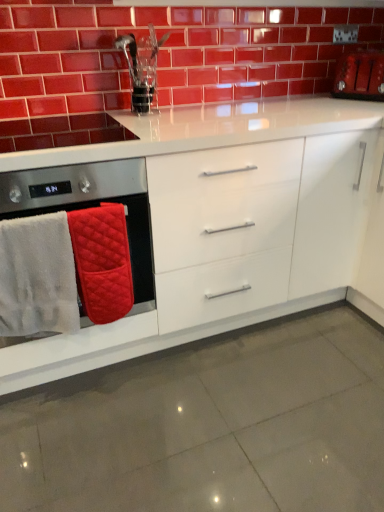
Question: Is quilted fabric oven mitts at left smaller than white glossy cabinet at center?

Choices:
 (A) no
 (B) yes

Answer: (B)

Question: Can you confirm if quilted fabric oven mitts at left is wider than white glossy cabinet at center?

Choices:
 (A) no
 (B) yes

Answer: (A)

Question: From the image's perspective, is quilted fabric oven mitts at left below white glossy cabinet at center?

Choices:
 (A) yes
 (B) no

Answer: (A)

Question: Could white glossy cabinet at center be considered to be inside quilted fabric oven mitts at left?

Choices:
 (A) yes
 (B) no

Answer: (B)

Question: Can you confirm if quilted fabric oven mitts at left is taller than white glossy cabinet at center?

Choices:
 (A) no
 (B) yes

Answer: (A)

Question: Could you tell me if quilted fabric oven mitts at left is turned towards white glossy cabinet at center?

Choices:
 (A) no
 (B) yes

Answer: (B)

Question: Is the depth of white fluffy bath towel at left, the 2th bath towel viewed from the right, less than that of matte red toaster at upper right?

Choices:
 (A) yes
 (B) no

Answer: (A)

Question: From the image's perspective, does white fluffy bath towel at left, the 2th bath towel viewed from the right, appear lower than matte red toaster at upper right?

Choices:
 (A) yes
 (B) no

Answer: (A)

Question: From the image's perspective, does white fluffy bath towel at left, the first bath towel in the left-to-right sequence, appear higher than matte red toaster at upper right?

Choices:
 (A) no
 (B) yes

Answer: (A)

Question: Could you tell me if white fluffy bath towel at left, the 2th bath towel viewed from the right, is facing matte red toaster at upper right?

Choices:
 (A) no
 (B) yes

Answer: (A)

Question: Is matte red toaster at upper right surrounded by white fluffy bath towel at left, the 2th bath towel viewed from the right?

Choices:
 (A) no
 (B) yes

Answer: (A)

Question: Is white fluffy bath towel at left, the 2th bath towel viewed from the right, taller than matte red toaster at upper right?

Choices:
 (A) yes
 (B) no

Answer: (A)

Question: Is glossy ceramic brickwork at upper center at the back of quilted fabric oven mitts at left?

Choices:
 (A) no
 (B) yes

Answer: (A)